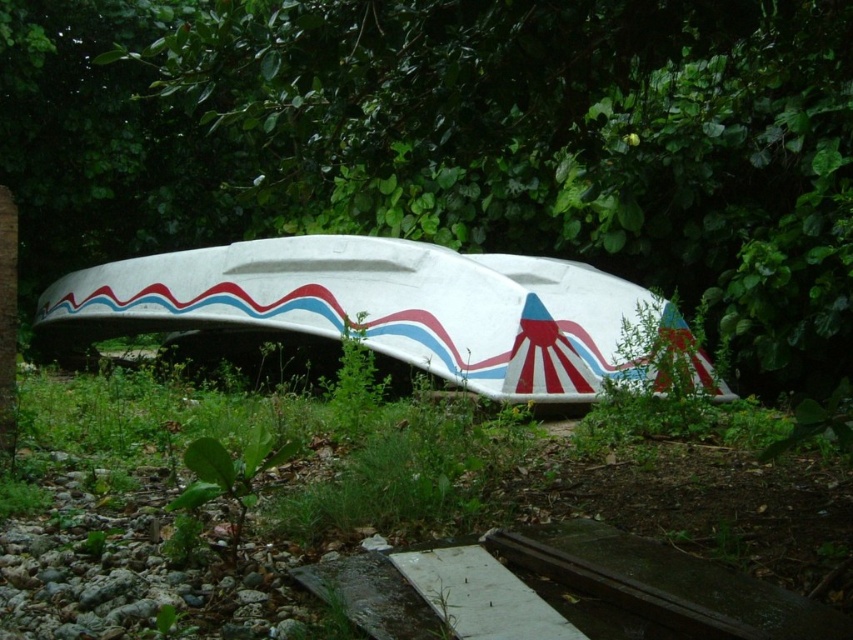
You are a bird flying over the abandoned boat scene. You want to land on the green leafy tree at center. From your current position above the white glossy boat at center, in which direction should you fly to reach the tree?

The green leafy tree at center is located above the white glossy boat at center, so you should fly upward to reach the tree.

You are a photographer standing in front of the green leafy tree at center. You want to take a photo of the abandoned boat while including the tree in the frame. Can you step back to ensure both the boat and the tree are fully visible without moving the camera?

The green leafy tree at center is 3.01 meters away from the camera. Since the tree is relatively close, stepping back might allow both the boat and the tree to be captured in the frame. However, the exact visibility depends on the camera lens and field of view. If the camera has a wide enough angle or zoom capability, stepping back should help include both subjects in the photo.